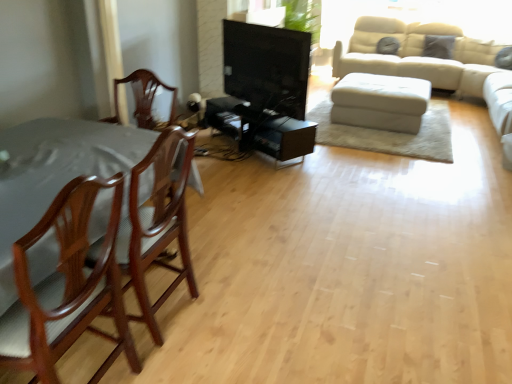
Question: Is point (338, 99) closer or farther from the camera than point (31, 243)?

Choices:
 (A) closer
 (B) farther

Answer: (B)

Question: From their relative heights in the image, would you say white leather ottoman at center is taller or shorter than mahogany wood chair at left, the second chair positioned from the back?

Choices:
 (A) tall
 (B) short

Answer: (B)

Question: Which object is positioned closest to the mahogany wood chair at left, which is the first chair from back to front?

Choices:
 (A) black glossy tv stand at center
 (B) mahogany wood chair at left, the second chair positioned from the back
 (C) white leather ottoman at center

Answer: (B)

Question: Which of these objects is positioned closest to the mahogany wood chair at left, the second chair viewed from the front?

Choices:
 (A) mahogany wood chair at left, the first chair positioned from the front
 (B) black glossy tv stand at center
 (C) white leather ottoman at center

Answer: (A)